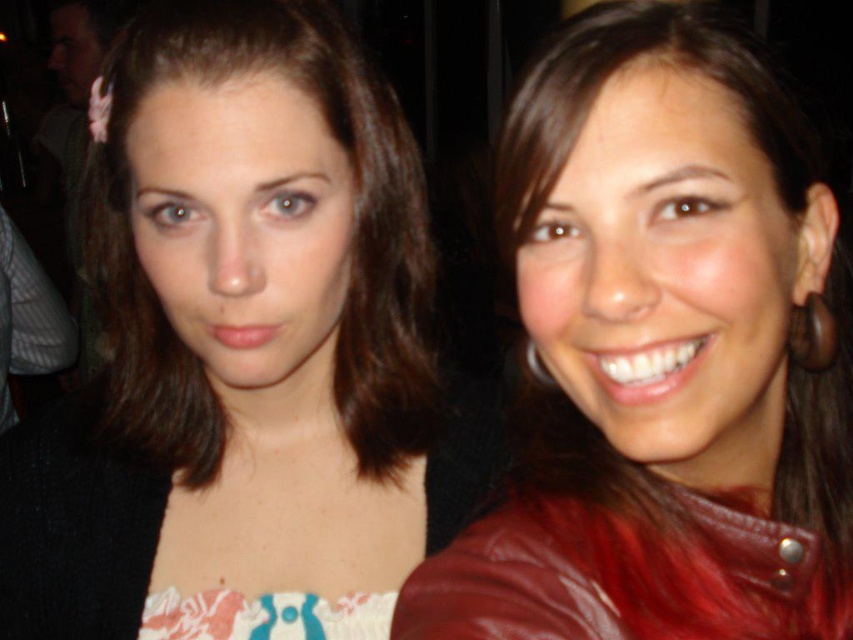
At what (x,y) coordinates should I click in order to perform the action: click on matte black hair at center. Please return your answer as a coordinate pair (x, y). The width and height of the screenshot is (853, 640). Looking at the image, I should click on (245, 344).

Who is shorter, matte black hair at center or red leather jacket at right?

With less height is red leather jacket at right.

Locate an element on the screen. The image size is (853, 640). matte black hair at center is located at coordinates (245, 344).